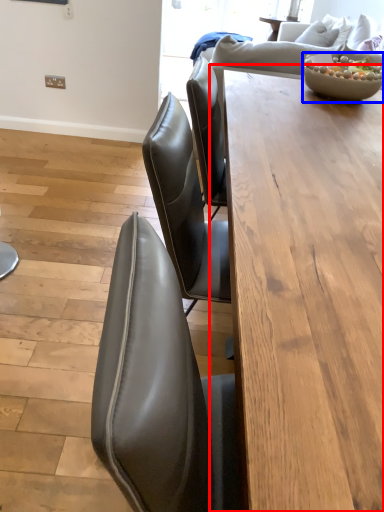
Question: Which object is closer to the camera taking this photo, table (highlighted by a red box) or bowl (highlighted by a blue box)?

Choices:
 (A) table
 (B) bowl

Answer: (A)